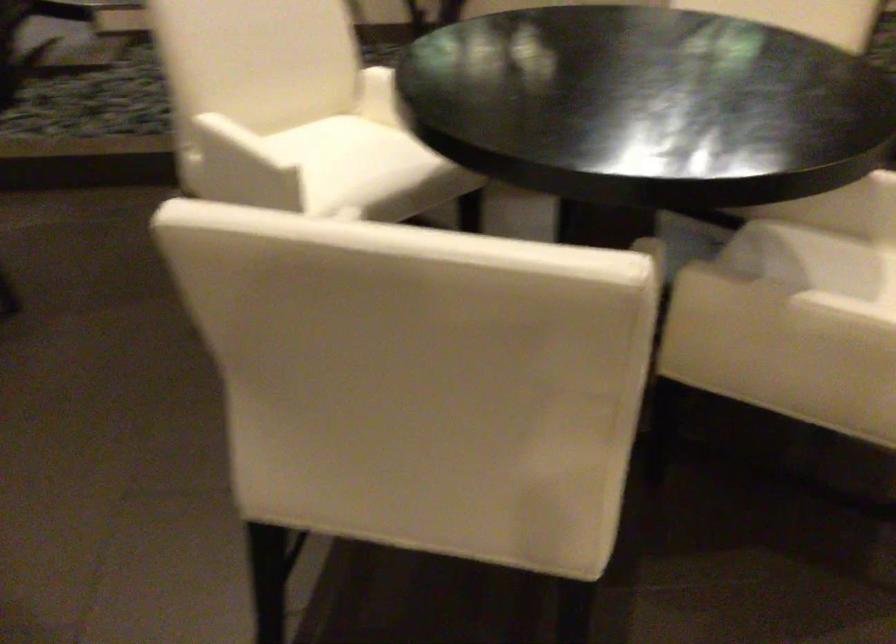
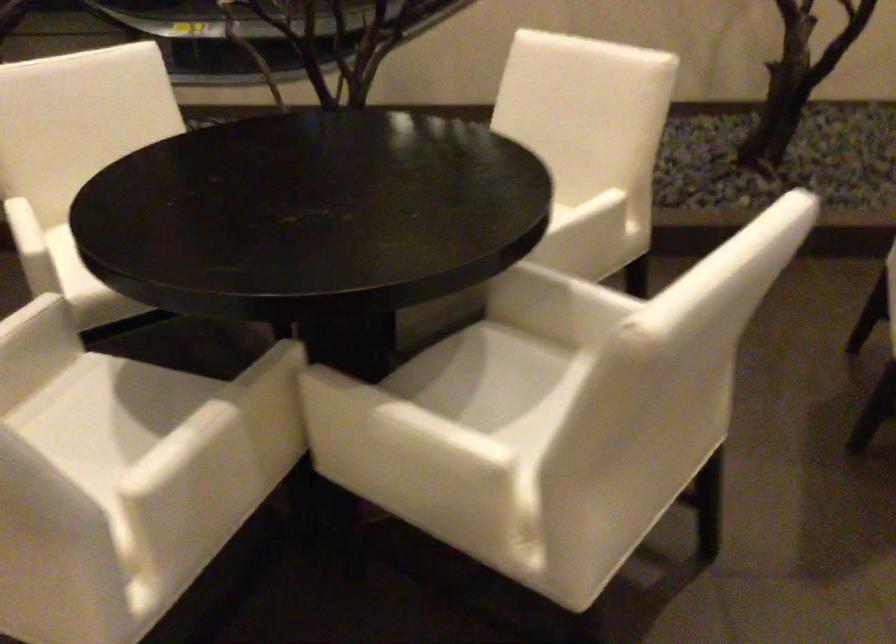
Where in the second image is the point corresponding to the point at 657,306 from the first image?

(271, 408)